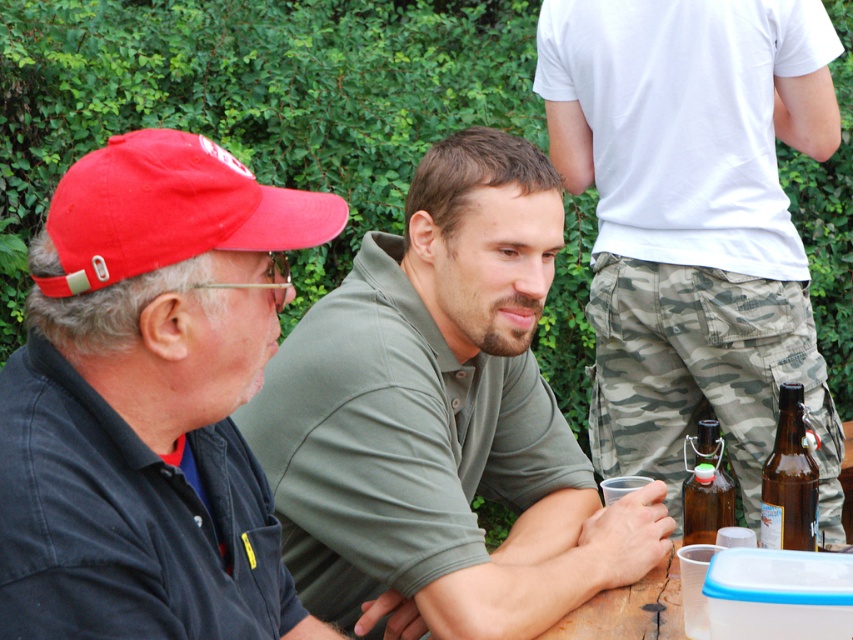
Question: Estimate the real-world distances between objects in this image. Which object is closer to the brown glass bottle at lower right?

Choices:
 (A) matte black shirt at left
 (B) camouflage pants at right
 (C) red fabric baseball cap at left
 (D) brown glass bottle at center

Answer: (D)

Question: Is green cotton shirt at center below matte black shirt at left?

Choices:
 (A) no
 (B) yes

Answer: (A)

Question: Is red fabric baseball cap at left closer to camera compared to brown glass bottle at center?

Choices:
 (A) no
 (B) yes

Answer: (B)

Question: In this image, where is camouflage pants at right located relative to red fabric baseball cap at left?

Choices:
 (A) left
 (B) right

Answer: (B)

Question: Which point appears farthest from the camera in this image?

Choices:
 (A) (286, 362)
 (B) (796, 508)

Answer: (A)

Question: Which point is closer to the camera?

Choices:
 (A) (215, 397)
 (B) (709, 472)

Answer: (A)